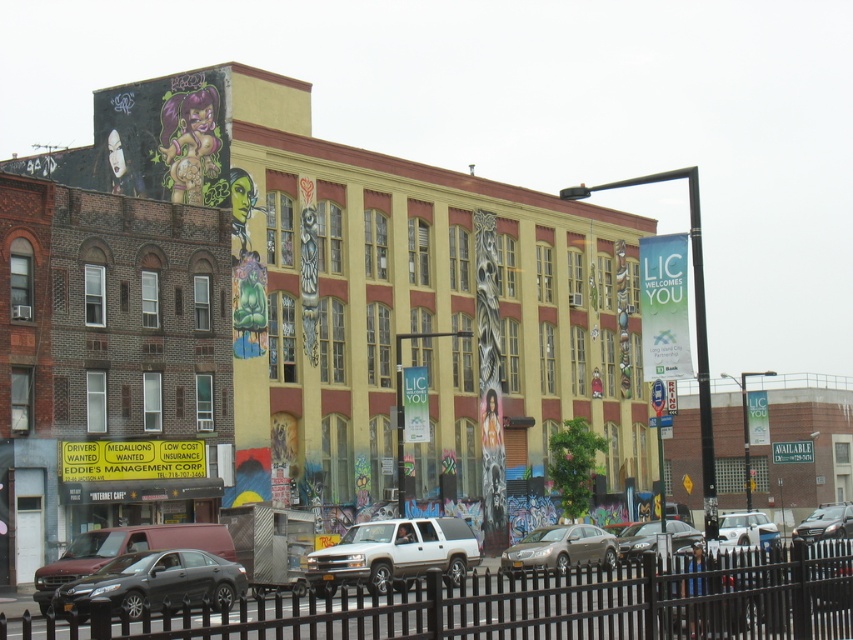
You are a delivery driver who needs to park your vehicle between the two cars in the image. Your delivery van is 2 meters tall. Can you safely park between the matte black sedan at lower left and the white matte car at lower right without hitting your head?

The matte black sedan at lower left is not as tall as white matte car at lower right. Since the tallest car is the white matte car at lower right, and its height is unknown, but the sedan is shorter, the minimum height between them might be insufficient. However, without specific height data, it is impossible to determine if 2 meters is safe. Please check the actual heights.

From the picture: You are a delivery driver needing to park your truck, which is wider than the silver metallic suv at center but narrower than the white matte car at lower right. Based on the scene, can you fit your truck between these two vehicles?

The silver metallic suv at center is thinner than the white matte car at lower right. Since your truck is wider than the silver metallic suv at center but narrower than the white matte car at lower right, it means your truck is wider than the suv but not as wide as the car. Therefore, the space between them may be sufficient if the truck is narrower than the white matte car at lower right. However, without knowing the exact width of the space between them, it is uncertain. The answer should strictly use the

You are standing next to a camera that is 5 feet tall. You want to take a photo of the silver metallic suv at center from a distance where the camera can capture the entire vehicle without distortion. Considering the camera has a maximum recommended distance of 150 feet for optimal clarity, will you need to move closer or farther away to ensure the photo meets the camera requirements?

The silver metallic suv at center and camera are 153.77 feet apart. Since the maximum recommended distance is 150 feet, you need to move closer to ensure the photo meets the camera requirements.